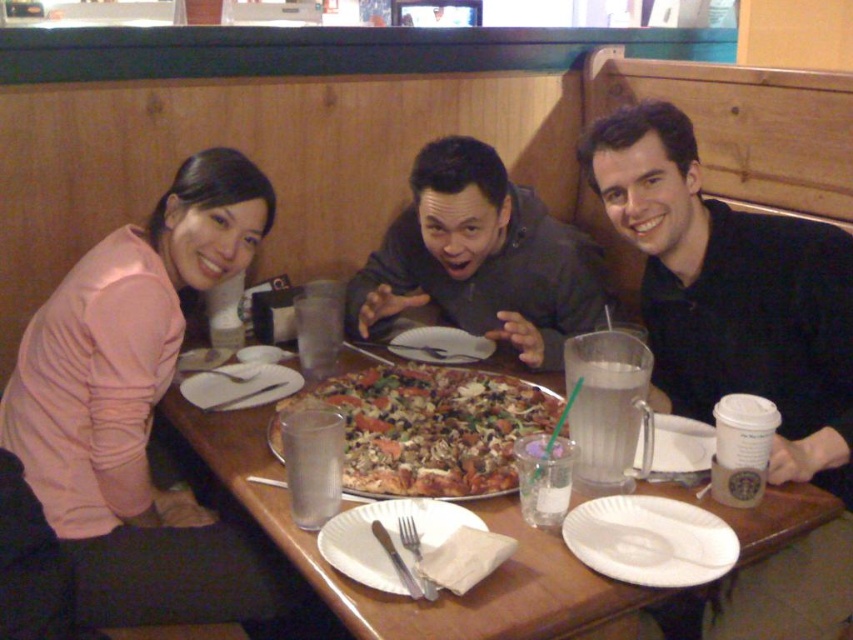
Question: Estimate the real-world distances between objects in this image. Which object is closer to the pink matte sweater at left?

Choices:
 (A) crusty golden-brown pizza at center
 (B) white paper plate at center

Answer: (A)

Question: Can you confirm if brown wooden table at center is smaller than dark gray hoodie at center?

Choices:
 (A) yes
 (B) no

Answer: (B)

Question: Considering the real-world distances, which object is closest to the crusty golden-brown pizza at center?

Choices:
 (A) black matte shirt at center
 (B) pink matte sweater at left

Answer: (B)

Question: Does brown wooden table at center have a smaller size compared to white paper plate at lower center?

Choices:
 (A) no
 (B) yes

Answer: (A)

Question: Considering the relative positions of black matte shirt at center and crusty golden-brown pizza at center in the image provided, where is black matte shirt at center located with respect to crusty golden-brown pizza at center?

Choices:
 (A) above
 (B) below

Answer: (A)

Question: Which object is closer to the camera taking this photo?

Choices:
 (A) white paper plate at lower center
 (B) white paper plate at center
 (C) brown wooden table at center

Answer: (C)